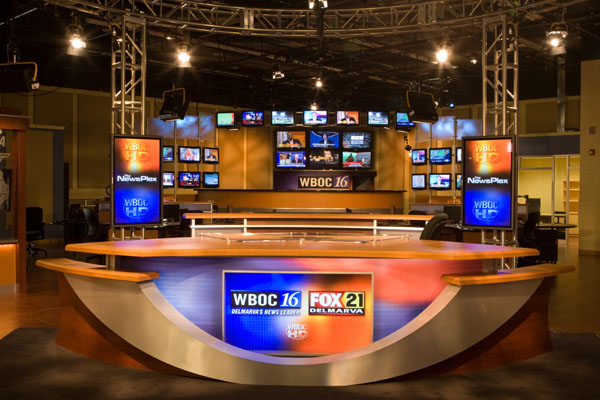
The height and width of the screenshot is (400, 600). What are the coordinates of `wall` in the screenshot? It's located at click(35, 180), click(75, 115), click(546, 124), click(548, 171).